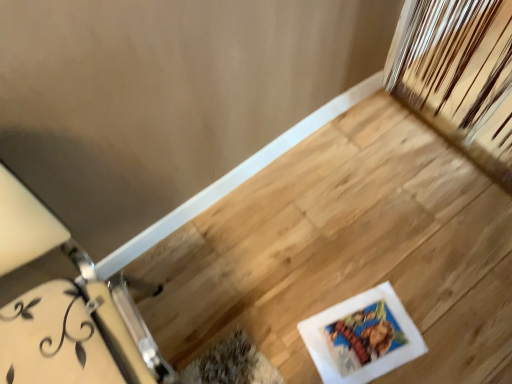
Question: Considering the relative positions of white glossy picture frame at lower right and white painted wood table at left in the image provided, is white glossy picture frame at lower right to the right of white painted wood table at left from the viewer's perspective?

Choices:
 (A) no
 (B) yes

Answer: (B)

Question: Is there a large distance between white glossy picture frame at lower right and white painted wood table at left?

Choices:
 (A) no
 (B) yes

Answer: (A)

Question: From a real-world perspective, is white glossy picture frame at lower right beneath white painted wood table at left?

Choices:
 (A) no
 (B) yes

Answer: (B)

Question: From the image's perspective, is white glossy picture frame at lower right on top of white painted wood table at left?

Choices:
 (A) no
 (B) yes

Answer: (A)

Question: Is white painted wood table at left completely or partially inside white glossy picture frame at lower right?

Choices:
 (A) no
 (B) yes

Answer: (A)

Question: From a real-world perspective, is white glossy picture frame at lower right physically above white painted wood table at left?

Choices:
 (A) yes
 (B) no

Answer: (B)

Question: Is white painted wood table at left thinner than white glossy picture frame at lower right?

Choices:
 (A) no
 (B) yes

Answer: (A)

Question: Does white painted wood table at left appear on the left side of white glossy picture frame at lower right?

Choices:
 (A) yes
 (B) no

Answer: (A)

Question: Does white painted wood table at left have a greater width compared to white glossy picture frame at lower right?

Choices:
 (A) no
 (B) yes

Answer: (B)

Question: From a real-world perspective, is white painted wood table at left positioned under white glossy picture frame at lower right based on gravity?

Choices:
 (A) no
 (B) yes

Answer: (A)

Question: From the image's perspective, is white painted wood table at left beneath white glossy picture frame at lower right?

Choices:
 (A) yes
 (B) no

Answer: (B)

Question: Is white painted wood table at left completely or partially outside of white glossy picture frame at lower right?

Choices:
 (A) yes
 (B) no

Answer: (A)

Question: Is white glossy picture frame at lower right spatially inside white painted wood table at left, or outside of it?

Choices:
 (A) outside
 (B) inside

Answer: (A)